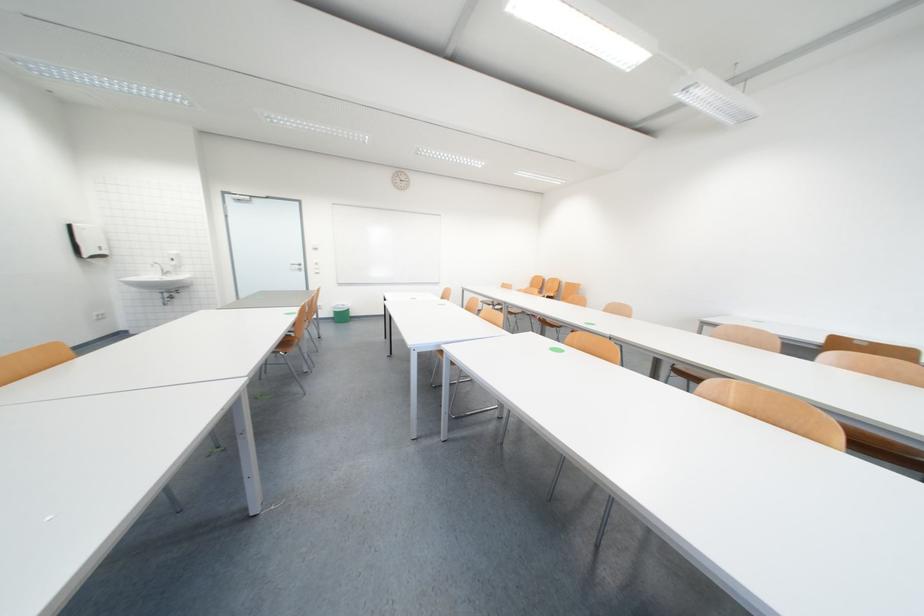
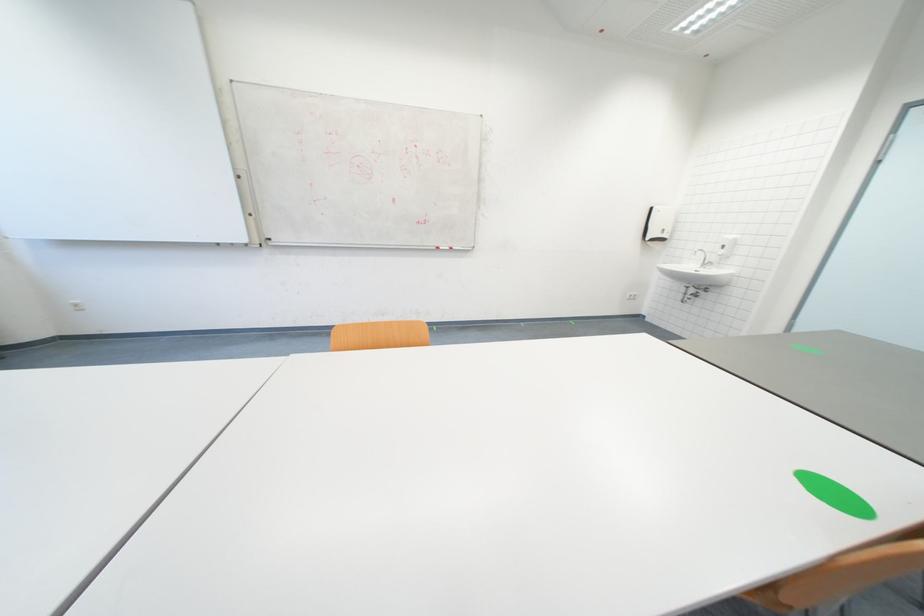
Locate, in the second image, the point that corresponds to the point at 99,257 in the first image.

(657, 241)